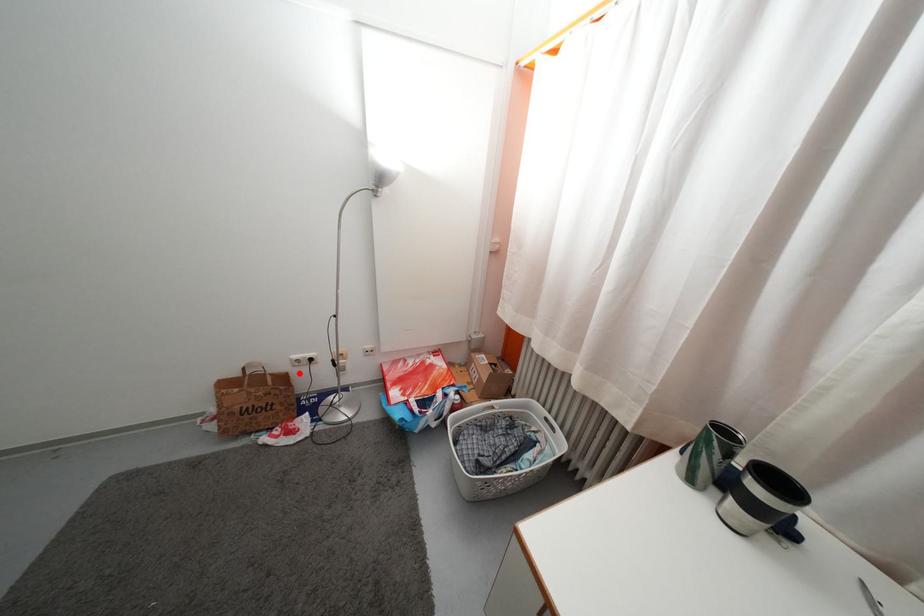
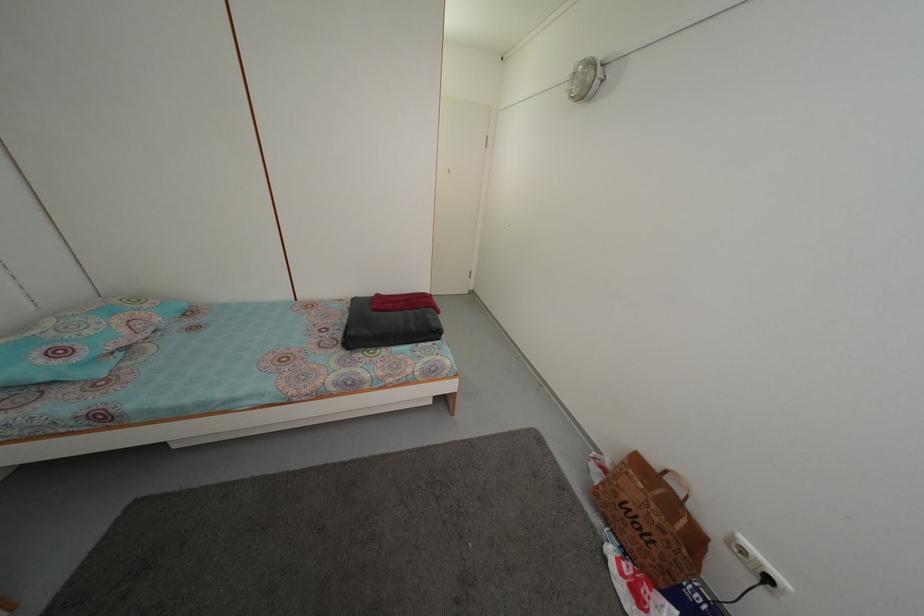
In the second image, find the point that corresponds to the highlighted location in the first image.

(733, 551)